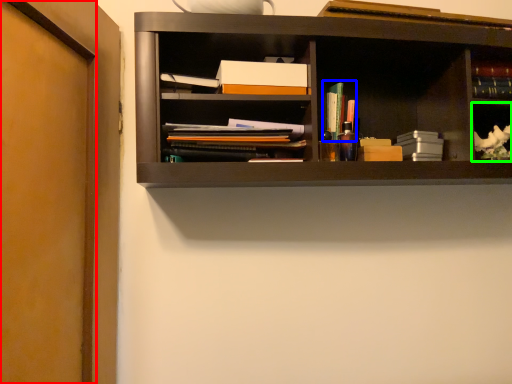
Question: Considering the real-world distances, which object is farthest from door (highlighted by a red box)? book (highlighted by a blue box) or cabinet (highlighted by a green box)?

Choices:
 (A) book
 (B) cabinet

Answer: (B)